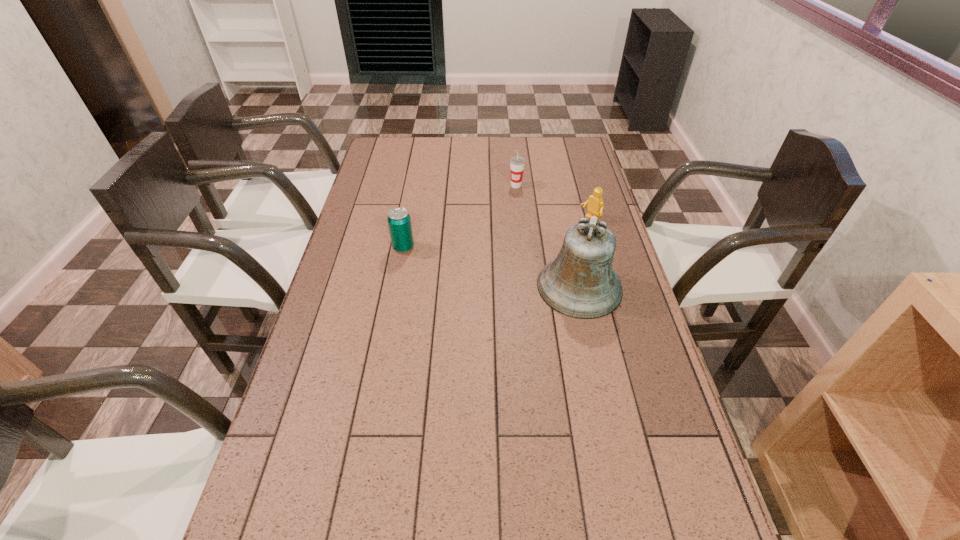
In order to click on free space on the desktop that is between the beer can and the bell and is positioned on the side of the farthest object with the logo in this screenshot , I will do `click(511, 271)`.

This screenshot has height=540, width=960. Find the location of `vacant spot on the desktop that is between the beer can and the bell and is positioned on the face of the Lego`. vacant spot on the desktop that is between the beer can and the bell and is positioned on the face of the Lego is located at coordinates (509, 271).